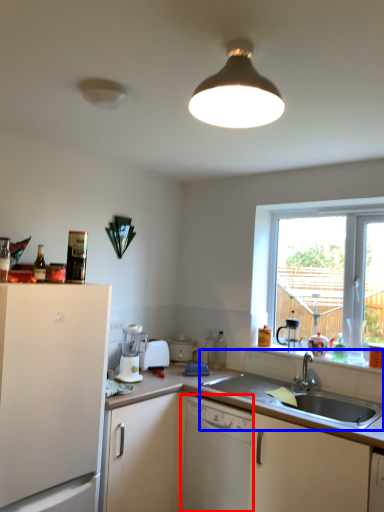
Question: Which of the following is the closest to the observer, dishwasher (highlighted by a red box) or sink (highlighted by a blue box)?

Choices:
 (A) dishwasher
 (B) sink

Answer: (B)